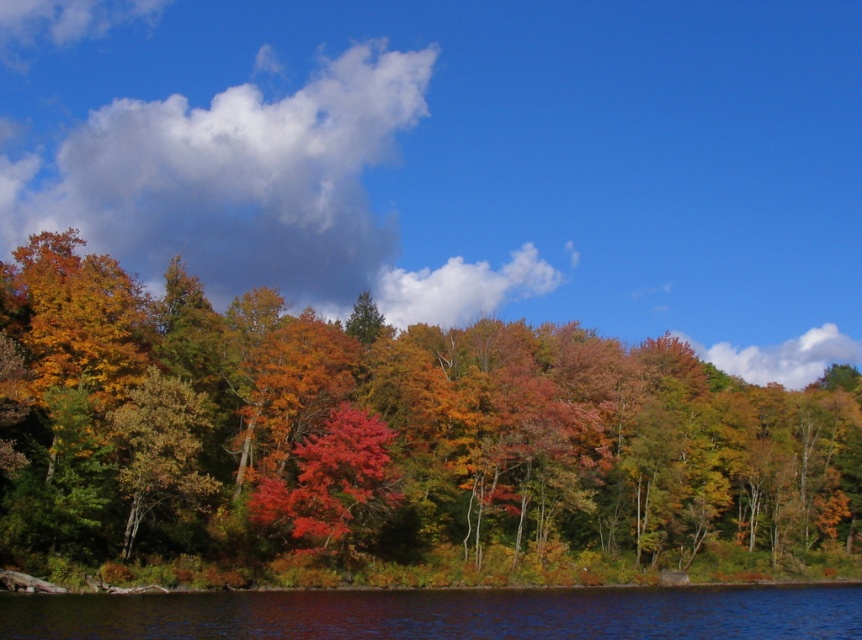
Can you confirm if white fluffy cloud at upper center is positioned above white fluffy cloud at upper right?

Yes.

Between point (413, 294) and point (859, 355), which one is positioned behind?

Positioned behind is point (859, 355).

Where is `white fluffy cloud at upper center`? This screenshot has width=862, height=640. white fluffy cloud at upper center is located at coordinates (461, 288).

Does autumn leaves at center have a greater height compared to white fluffy cloud at upper center?

Yes.

Identify the location of autumn leaves at center. The image size is (862, 640). (386, 440).

Who is positioned more to the left, autumn leaves at center or transparent blue water at lower center?

transparent blue water at lower center

Is autumn leaves at center taller than transparent blue water at lower center?

Indeed, autumn leaves at center has a greater height compared to transparent blue water at lower center.

Locate an element on the screen. The width and height of the screenshot is (862, 640). autumn leaves at center is located at coordinates (386, 440).